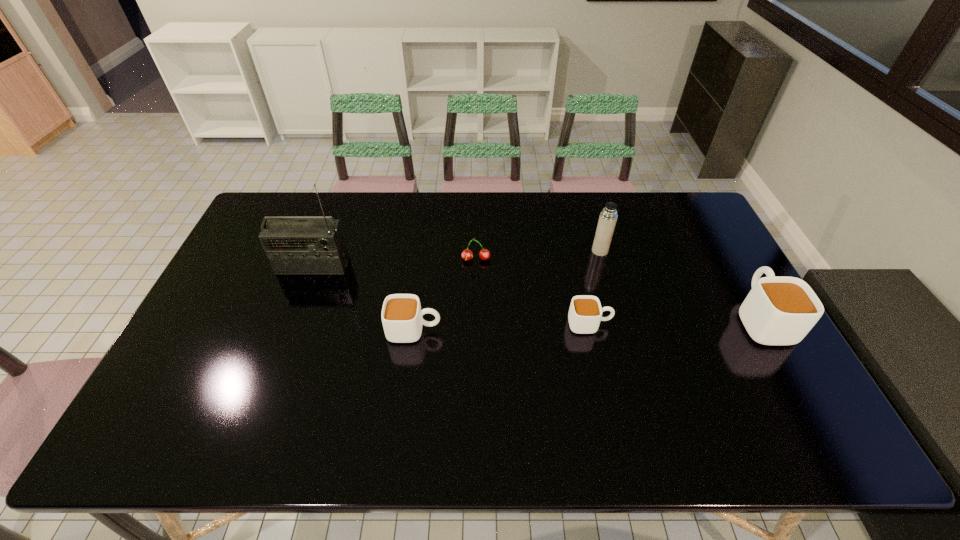
Where is `the leftmost cup`? the leftmost cup is located at coordinates (401, 315).

You are a GUI agent. You are given a task and a screenshot of the screen. Output one action in this format:
    pyautogui.click(x=<x>, y=<y>)
    Task: Click on the second object from left to right
    The image size is (960, 540).
    Given the screenshot: What is the action you would take?
    pyautogui.click(x=401, y=315)

You are a GUI agent. You are given a task and a screenshot of the screen. Output one action in this format:
    pyautogui.click(x=<x>, y=<y>)
    Task: Click on the second cup from right to left
    This screenshot has height=540, width=960.
    Given the screenshot: What is the action you would take?
    pyautogui.click(x=585, y=313)

Where is `the rightmost object`? The image size is (960, 540). the rightmost object is located at coordinates (778, 310).

This screenshot has width=960, height=540. I want to click on the rightmost cup, so click(x=778, y=310).

Locate an element on the screen. the fifth shortest object is located at coordinates (608, 217).

What are the coordinates of `the fourth object from right to left` in the screenshot? It's located at (484, 254).

The height and width of the screenshot is (540, 960). In order to click on the tallest object in this screenshot , I will do `click(293, 244)`.

This screenshot has height=540, width=960. What are the coordinates of `radio receiver` in the screenshot? It's located at (293, 244).

Where is `free location located 0.080m on the side with the handle of the leftmost cup`? free location located 0.080m on the side with the handle of the leftmost cup is located at coordinates (470, 330).